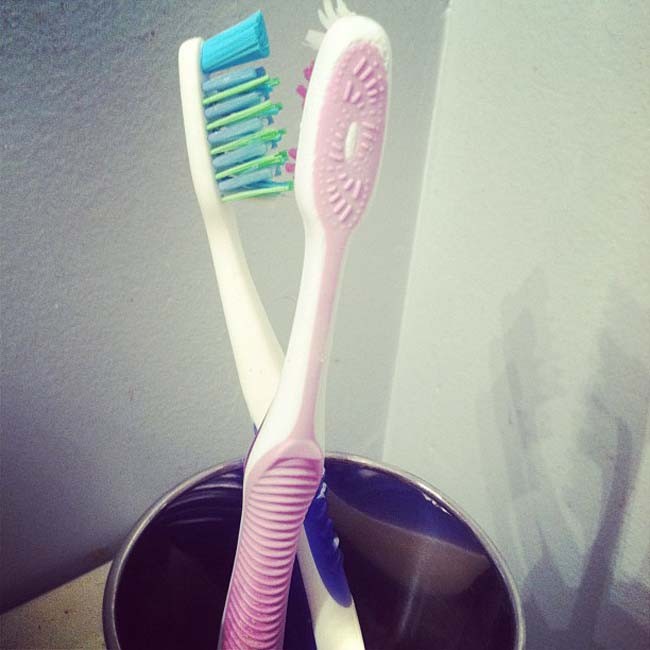
Where is `round cup`? round cup is located at coordinates (387, 569).